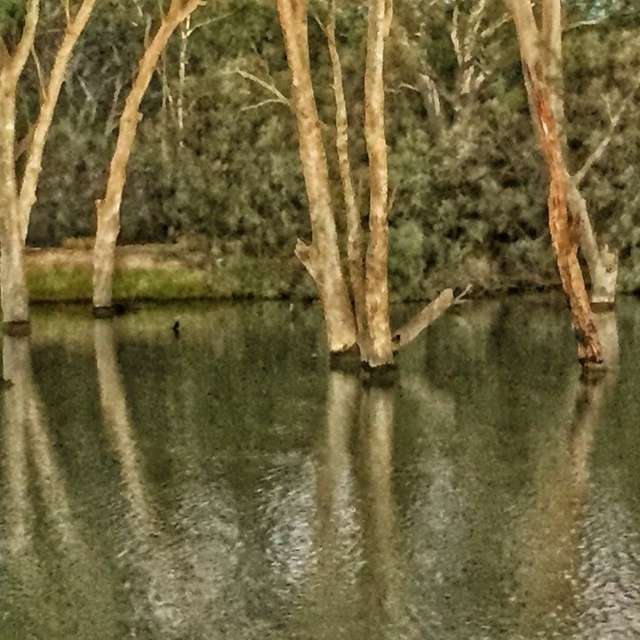
Find the location of a particular element. The height and width of the screenshot is (640, 640). greenish reflective water at center is located at coordinates (316, 481).

Based on the photo, is greenish reflective water at center to the right of brown rough bark tree at center from the viewer's perspective?

No, greenish reflective water at center is not to the right of brown rough bark tree at center.

Which is behind, point (260, 536) or point (195, 216)?

The point (195, 216) is behind.

Where is `greenish reflective water at center`? The width and height of the screenshot is (640, 640). greenish reflective water at center is located at coordinates 316,481.